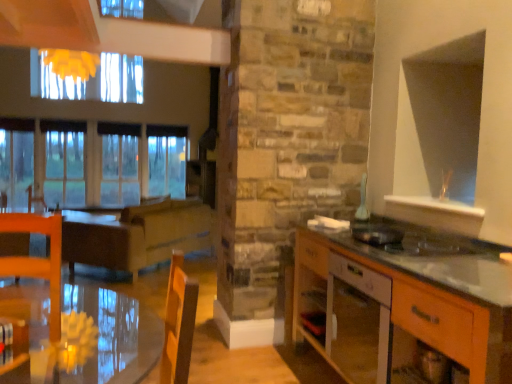
This screenshot has width=512, height=384. What do you see at coordinates (135, 234) in the screenshot?
I see `brown wooden table at center` at bounding box center [135, 234].

What are the coordinates of `brown wooden table at center` in the screenshot? It's located at (135, 234).

How much space does metallic silver toaster at right, which ranks as the 1th appliance in bottom-to-top order, occupy horizontally?

It is 11.80 inches.

Where is `brown wooden table at center`? brown wooden table at center is located at coordinates (135, 234).

Is transparent glass window at left far away from brown leather armchair at left?

That's not correct — transparent glass window at left is a little close to brown leather armchair at left.

You are a GUI agent. You are given a task and a screenshot of the screen. Output one action in this format:
    pyautogui.click(x=<x>, y=<y>)
    Task: Click on the window behind the brown leather armchair at left
    The image size is (512, 384).
    Given the screenshot: What is the action you would take?
    pyautogui.click(x=101, y=161)

Is transparent glass window at left situated inside brown leather armchair at left or outside?

transparent glass window at left is located beyond the bounds of brown leather armchair at left.

Considering the sizes of objects transparent glass window at left and brown leather armchair at left in the image provided, who is shorter, transparent glass window at left or brown leather armchair at left?

brown leather armchair at left.

The height and width of the screenshot is (384, 512). Find the location of `surround on the right of brown leather armchair at left`. surround on the right of brown leather armchair at left is located at coordinates (135, 234).

Do you think brown wooden table at center is within brown leather armchair at left, or outside of it?

The correct answer is: outside.

Relative to brown leather armchair at left, is brown wooden table at center in front or behind?

Clearly, brown wooden table at center is in front of brown leather armchair at left.

Considering the positions of objects brown wooden table at center and brown leather armchair at left in the image provided, who is more to the left, brown wooden table at center or brown leather armchair at left?

Positioned to the left is brown leather armchair at left.

Is transparent glass table at lower left in front of or behind wooden cabinet at right in the image?

Clearly, transparent glass table at lower left is in front of wooden cabinet at right.

Does transparent glass table at lower left turn towards wooden cabinet at right?

No.

From the image's perspective, which one is positioned higher, transparent glass table at lower left or metallic silver toaster at right, which ranks as the 1th appliance in bottom-to-top order?

metallic silver toaster at right, which ranks as the 1th appliance in bottom-to-top order, appears higher in the image.

Is transparent glass table at lower left not inside metallic silver toaster at right, acting as the second appliance starting from the top?

That's correct, transparent glass table at lower left is outside of metallic silver toaster at right, acting as the second appliance starting from the top.

From a real-world perspective, who is located lower, transparent glass table at lower left or metallic silver toaster at right, marked as the first appliance in a front-to-back arrangement?

transparent glass table at lower left is physically lower.

In the image, is metallic silver toaster at right, which ranks as the 1th appliance in bottom-to-top order, positioned in front of or behind transparent glass table at lower left?

metallic silver toaster at right, which ranks as the 1th appliance in bottom-to-top order, is behind transparent glass table at lower left.

Is metallic silver toaster at right, acting as the second appliance starting from the top, directly adjacent to transparent glass table at lower left?

metallic silver toaster at right, acting as the second appliance starting from the top, and transparent glass table at lower left are clearly separated.

What's the angular difference between metallic silver toaster at right, which ranks as the 1th appliance in bottom-to-top order, and transparent glass table at lower left's facing directions?

0.0012 degrees.

Considering the relative sizes of metallic silver toaster at right, acting as the 2th appliance starting from the back, and transparent glass table at lower left in the image provided, is metallic silver toaster at right, acting as the 2th appliance starting from the back, wider than transparent glass table at lower left?

In fact, metallic silver toaster at right, acting as the 2th appliance starting from the back, might be narrower than transparent glass table at lower left.

Considering the sizes of objects metallic silver toaster at right, acting as the second appliance starting from the top, and brown wooden table at center in the image provided, who is thinner, metallic silver toaster at right, acting as the second appliance starting from the top, or brown wooden table at center?

metallic silver toaster at right, acting as the second appliance starting from the top, is thinner.

Considering the sizes of objects metallic silver toaster at right, marked as the first appliance in a front-to-back arrangement, and brown wooden table at center in the image provided, who is smaller, metallic silver toaster at right, marked as the first appliance in a front-to-back arrangement, or brown wooden table at center?

metallic silver toaster at right, marked as the first appliance in a front-to-back arrangement, is smaller.

From the image's perspective, who appears lower, metallic silver toaster at right, acting as the 2th appliance starting from the back, or brown wooden table at center?

brown wooden table at center is shown below in the image.

Looking at this image, is white glossy vase at upper right, arranged as the second appliance when viewed from the front, positioned with its back to transparent glass window at left?

white glossy vase at upper right, arranged as the second appliance when viewed from the front, is not turned away from transparent glass window at left.

Which object is wider, white glossy vase at upper right, the 2th appliance from the bottom, or transparent glass window at left?

With larger width is transparent glass window at left.

Is point (369, 215) more distant than point (55, 139)?

No, it is not.

From the image's perspective, who appears lower, white glossy vase at upper right, which is the 1th appliance from top to bottom, or transparent glass window at left?

white glossy vase at upper right, which is the 1th appliance from top to bottom, appears lower in the image.

Where is `window on the right of the brown leather armchair at left`? window on the right of the brown leather armchair at left is located at coordinates (101, 161).

This screenshot has height=384, width=512. Find the location of `surround below the brown leather armchair at left (from the image's perspective)`. surround below the brown leather armchair at left (from the image's perspective) is located at coordinates (135, 234).

Looking at the image, which one is located further to brown wooden table at center, transparent glass window at left or white glossy vase at upper right, the first appliance in the back-to-front sequence?

The object further to brown wooden table at center is white glossy vase at upper right, the first appliance in the back-to-front sequence.

Considering their positions, is wooden cabinet at right positioned further to white glossy vase at upper right, arranged as the second appliance when viewed from the front, than brown wooden table at center?

Among the two, brown wooden table at center is located further to white glossy vase at upper right, arranged as the second appliance when viewed from the front.

Looking at the image, which one is located further to transparent glass table at lower left, transparent glass window at left or white glossy vase at upper right, arranged as the second appliance when viewed from the front?

Among the two, transparent glass window at left is located further to transparent glass table at lower left.

Estimate the real-world distances between objects in this image. Which object is closer to brown leather armchair at left, brown wooden table at center or wooden cabinet at right?

Among the two, brown wooden table at center is located nearer to brown leather armchair at left.

Looking at the image, which one is located closer to transparent glass table at lower left, metallic silver toaster at right, marked as the first appliance in a front-to-back arrangement, or white glossy vase at upper right, the 2th appliance from the bottom?

metallic silver toaster at right, marked as the first appliance in a front-to-back arrangement, is positioned closer to the anchor transparent glass table at lower left.

Which object lies nearer to the anchor point white glossy vase at upper right, arranged as the second appliance when viewed from the front, metallic silver toaster at right, marked as the first appliance in a front-to-back arrangement, or wooden cabinet at right?

metallic silver toaster at right, marked as the first appliance in a front-to-back arrangement, is closer to white glossy vase at upper right, arranged as the second appliance when viewed from the front.

When comparing their distances from transparent glass table at lower left, does brown wooden table at center or transparent glass window at left seem further?

transparent glass window at left.

Which object lies nearer to the anchor point brown leather armchair at left, white glossy vase at upper right, which is the 1th appliance from top to bottom, or metallic silver toaster at right, marked as the first appliance in a front-to-back arrangement?

white glossy vase at upper right, which is the 1th appliance from top to bottom.

Identify the location of surround between transparent glass table at lower left and brown leather armchair at left from front to back. The height and width of the screenshot is (384, 512). (135, 234).

Find the location of a particular element. cabinetry between transparent glass table at lower left and brown wooden table at center from front to back is located at coordinates (405, 305).

The height and width of the screenshot is (384, 512). In order to click on surround between metallic silver toaster at right, marked as the first appliance in a front-to-back arrangement, and transparent glass window at left in the front-back direction in this screenshot , I will do `click(135, 234)`.

Find the location of `cabinetry located between transparent glass table at lower left and white glossy vase at upper right, the first appliance in the back-to-front sequence, in the depth direction`. cabinetry located between transparent glass table at lower left and white glossy vase at upper right, the first appliance in the back-to-front sequence, in the depth direction is located at coordinates (405, 305).